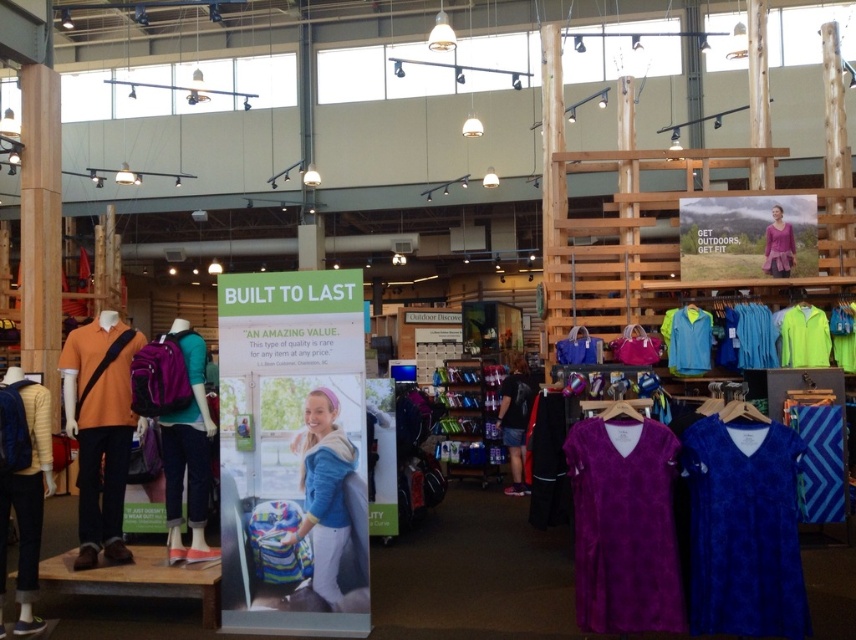
Who is higher up, blue velour shirt at lower right or neon yellow fabric at upper right?

neon yellow fabric at upper right

Measure the distance between blue velour shirt at lower right and camera.

They are 4.35 meters apart.

This screenshot has width=856, height=640. Find the location of `blue velour shirt at lower right`. blue velour shirt at lower right is located at coordinates (742, 529).

Who is positioned more to the left, blue velour shirt at lower right or neon green fleece jacket at right?

blue velour shirt at lower right

Looking at this image, does blue velour shirt at lower right have a lesser width compared to neon green fleece jacket at right?

In fact, blue velour shirt at lower right might be wider than neon green fleece jacket at right.

Is point (742, 545) in front of point (849, 358)?

That is True.

Where is `blue velour shirt at lower right`? blue velour shirt at lower right is located at coordinates (742, 529).

Between point (828, 346) and point (694, 336), which one is positioned behind?

The point (694, 336) is behind.

Looking at this image, who is more forward, (x=792, y=326) or (x=703, y=332)?

Positioned in front is point (x=792, y=326).

Locate an element on the screen. This screenshot has width=856, height=640. neon yellow fabric at upper right is located at coordinates (804, 337).